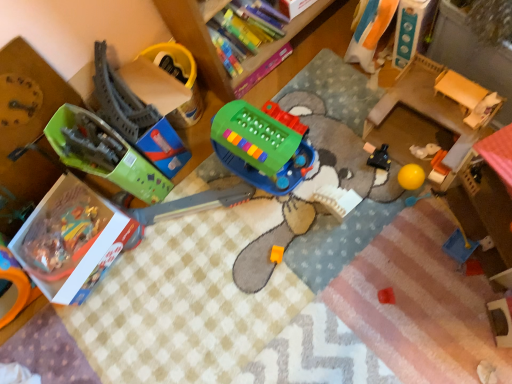
Question: In terms of height, does orange fabric doll at upper right, the fourth toy when ordered from left to right, look taller or shorter compared to matte cardboard box at upper center, which is counted as the second box, starting from the bottom?

Choices:
 (A) tall
 (B) short

Answer: (A)

Question: From a real-world perspective, is orange fabric doll at upper right, the fourth toy when ordered from left to right, above or below matte cardboard box at upper center, the first box in the right-to-left sequence?

Choices:
 (A) above
 (B) below

Answer: (B)

Question: Which is farther from the blue plastic dustpan at lower right, the 6th toy in the left-to-right sequence?

Choices:
 (A) wooden changing table at right
 (B) gray plastic train tracks at left, the 5th toy positioned from the right
 (C) green plastic toy at center, placed as the third toy when sorted from left to right
 (D) orange fabric doll at upper right, the fourth toy when ordered from left to right
 (E) gray plastic train tracks at left, placed as the sixth toy when sorted from right to left

Answer: (E)

Question: Based on their relative distances, which object is farther from the matte cardboard box at upper center, which is counted as the second box, starting from the bottom?

Choices:
 (A) gray plastic train tracks at left, marked as the 1th toy in a left-to-right arrangement
 (B) blue plastic dustpan at lower right, which ranks as the 1th toy in right-to-left order
 (C) hardcover book at upper center
 (D) green cardboard box at left
 (E) black plastic toy at center-right, which is the 5th toy in left-to-right order

Answer: (B)